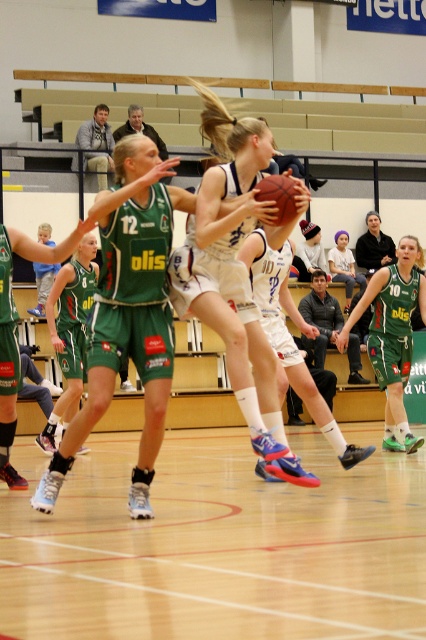
Based on the photo, you are a referee observing the game. You notice the white matte basketball player at center and the rubber textured basketball at center. Which object is closer to the left side of the court?

The white matte basketball player at center is positioned on the left side of the rubber textured basketball at center, so the white matte basketball player at center is closer to the left side of the court.

You are a referee observing the game. You need to determine if the white matte basketball player at center is bigger than the rubber textured basketball at center. Can you confirm this?

The white matte basketball player at center has a larger size compared to the rubber textured basketball at center, so yes, the player is bigger than the ball.